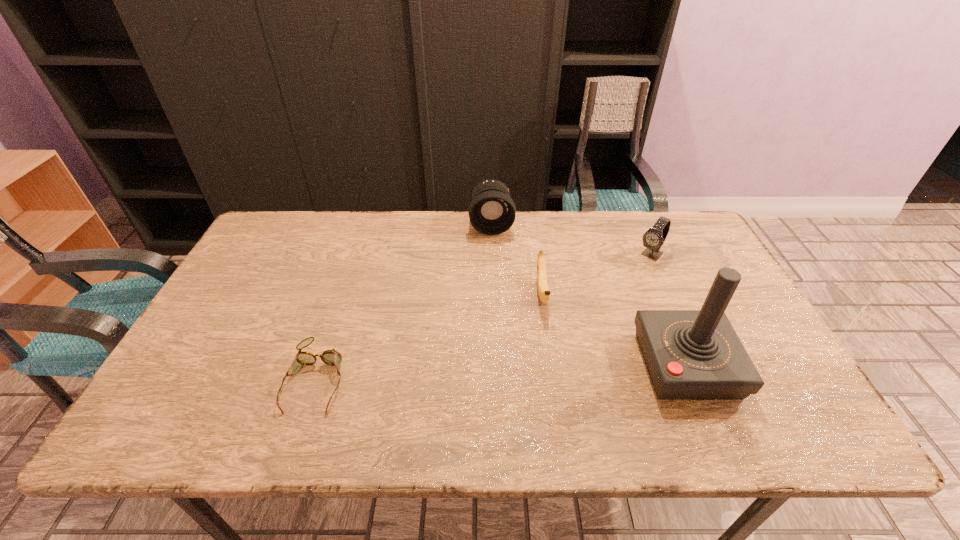
The width and height of the screenshot is (960, 540). I want to click on telephoto lens situated at the far edge, so click(x=492, y=211).

I want to click on spectacles that is at the near edge, so click(x=331, y=357).

Where is `joystick at the near edge`? This screenshot has width=960, height=540. joystick at the near edge is located at coordinates (690, 354).

At what (x,y) coordinates should I click in order to perform the action: click on joystick present at the right edge. Please return your answer as a coordinate pair (x, y). The height and width of the screenshot is (540, 960). Looking at the image, I should click on (690, 354).

Identify the location of watch at the right edge. (654, 237).

In order to click on object located in the far right corner section of the desktop in this screenshot , I will do `click(654, 237)`.

Find the location of a particular element. The width and height of the screenshot is (960, 540). object situated at the near right corner is located at coordinates (690, 354).

Find the location of a particular element. The image size is (960, 540). free space at the far edge of the desktop is located at coordinates (634, 249).

I want to click on vacant point at the left edge, so click(282, 258).

Where is `free space at the right edge`? This screenshot has width=960, height=540. free space at the right edge is located at coordinates (756, 341).